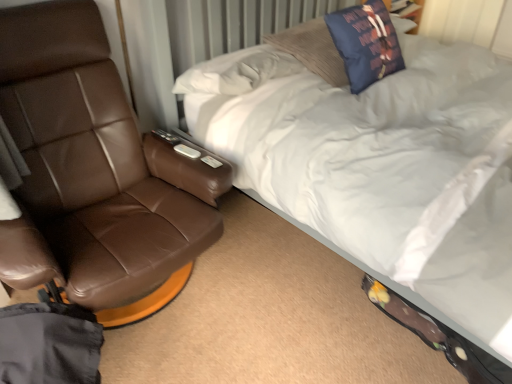
The image size is (512, 384). What do you see at coordinates (365, 43) in the screenshot?
I see `navy blue fabric pillow at upper center` at bounding box center [365, 43].

Locate an element on the screen. Image resolution: width=512 pixels, height=384 pixels. white soft bed at upper right is located at coordinates (379, 162).

Where is `brown leather chair at left`? This screenshot has height=384, width=512. brown leather chair at left is located at coordinates (96, 173).

From a real-world perspective, which object stands above the other?

navy blue fabric pillow at upper center.

Consider the image. Could you tell me if white soft bed at upper right is turned towards navy blue fabric pillow at upper center?

Yes, white soft bed at upper right is oriented towards navy blue fabric pillow at upper center.

At what (x,y) coordinates should I click in order to perform the action: click on throw pillow above the white soft bed at upper right (from the image's perspective). Please return your answer as a coordinate pair (x, y). This screenshot has width=512, height=384. Looking at the image, I should click on (365, 43).

Considering the sizes of objects white soft bed at upper right and brown leather chair at left in the image provided, who is thinner, white soft bed at upper right or brown leather chair at left?

brown leather chair at left is thinner.

Is white soft bed at upper right bigger or smaller than brown leather chair at left?

In the image, white soft bed at upper right appears to be larger than brown leather chair at left.

Does white soft bed at upper right lie behind brown leather chair at left?

No.

Are brown leather chair at left and white soft bed at upper right making contact?

There is a gap between brown leather chair at left and white soft bed at upper right.

From a real-world perspective, is brown leather chair at left over white soft bed at upper right?

No, from a real-world perspective, brown leather chair at left is not above white soft bed at upper right.

Is brown leather chair at left to the right of white soft bed at upper right from the viewer's perspective?

No, brown leather chair at left is not to the right of white soft bed at upper right.

Find the location of `bed that is on the right side of brown leather chair at left`. bed that is on the right side of brown leather chair at left is located at coordinates (379, 162).

Considering the positions of points (339, 11) and (79, 17), is point (339, 11) farther from camera compared to point (79, 17)?

Yes, it is.

Considering the sizes of objects navy blue fabric pillow at upper center and brown leather chair at left in the image provided, who is smaller, navy blue fabric pillow at upper center or brown leather chair at left?

Smaller between the two is navy blue fabric pillow at upper center.

How distant is navy blue fabric pillow at upper center from brown leather chair at left?

navy blue fabric pillow at upper center is 38.84 inches away from brown leather chair at left.

Which of these two, navy blue fabric pillow at upper center or brown leather chair at left, stands taller?

With more height is brown leather chair at left.

Considering the positions of point (67, 176) and point (365, 56), is point (67, 176) closer or farther from the camera than point (365, 56)?

Point (67, 176) appears to be closer to the viewer than point (365, 56).

Considering the relative sizes of brown leather chair at left and navy blue fabric pillow at upper center in the image provided, is brown leather chair at left thinner than navy blue fabric pillow at upper center?

No.

In the scene shown: Considering the relative sizes of brown leather chair at left and navy blue fabric pillow at upper center in the image provided, is brown leather chair at left shorter than navy blue fabric pillow at upper center?

No.

Is brown leather chair at left at the right side of navy blue fabric pillow at upper center?

Incorrect, brown leather chair at left is not on the right side of navy blue fabric pillow at upper center.

Considering the sizes of objects navy blue fabric pillow at upper center and white soft bed at upper right in the image provided, who is taller, navy blue fabric pillow at upper center or white soft bed at upper right?

white soft bed at upper right.

Considering the points (359, 59) and (230, 61), which point is behind, point (359, 59) or point (230, 61)?

Point (230, 61)

Looking at the image, does navy blue fabric pillow at upper center seem bigger or smaller compared to white soft bed at upper right?

Considering their sizes, navy blue fabric pillow at upper center takes up less space than white soft bed at upper right.

Is white soft bed at upper right at the back of navy blue fabric pillow at upper center?

That's right, navy blue fabric pillow at upper center is facing away from white soft bed at upper right.

Locate an element on the screen. bed beneath the navy blue fabric pillow at upper center (from a real-world perspective) is located at coordinates (379, 162).

You are a GUI agent. You are given a task and a screenshot of the screen. Output one action in this format:
    pyautogui.click(x=<x>, y=<y>)
    Task: Click on the bed above the brown leather chair at left (from the image's perspective)
    This screenshot has height=384, width=512.
    Given the screenshot: What is the action you would take?
    pyautogui.click(x=379, y=162)

From the image, which object appears to be nearer to navy blue fabric pillow at upper center, white soft bed at upper right or brown leather chair at left?

Among the two, white soft bed at upper right is located nearer to navy blue fabric pillow at upper center.

From the image, which object appears to be farther from brown leather chair at left, white soft bed at upper right or navy blue fabric pillow at upper center?

The object further to brown leather chair at left is navy blue fabric pillow at upper center.

Estimate the real-world distances between objects in this image. Which object is further from navy blue fabric pillow at upper center, brown leather chair at left or white soft bed at upper right?

brown leather chair at left lies further to navy blue fabric pillow at upper center than the other object.

From the image, which object appears to be farther from brown leather chair at left, navy blue fabric pillow at upper center or white soft bed at upper right?

navy blue fabric pillow at upper center is positioned further to the anchor brown leather chair at left.

Considering their positions, is navy blue fabric pillow at upper center positioned closer to white soft bed at upper right than brown leather chair at left?

navy blue fabric pillow at upper center is closer to white soft bed at upper right.

Estimate the real-world distances between objects in this image. Which object is closer to white soft bed at upper right, brown leather chair at left or navy blue fabric pillow at upper center?

navy blue fabric pillow at upper center is positioned closer to the anchor white soft bed at upper right.

What are the coordinates of `throw pillow between brown leather chair at left and white soft bed at upper right` in the screenshot? It's located at (365, 43).